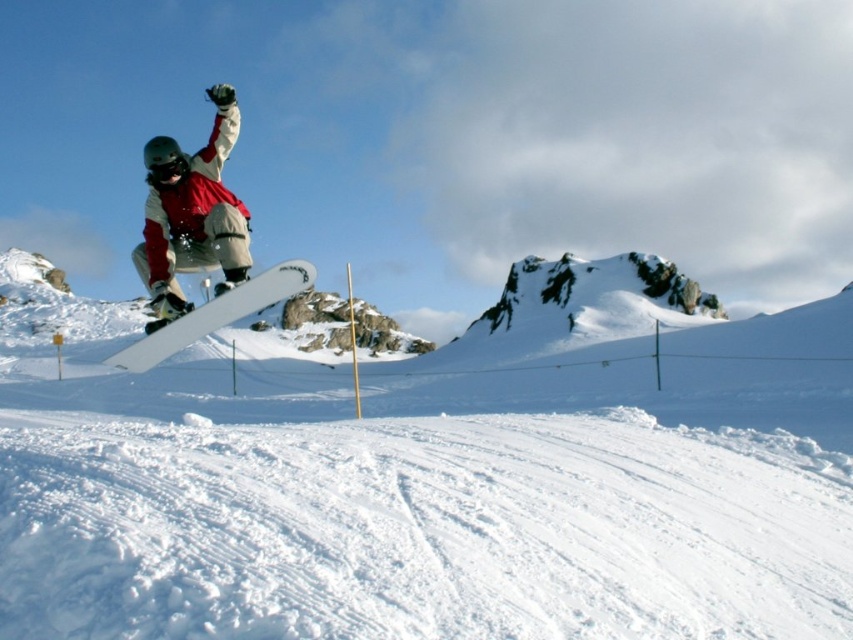
Question: Among these objects, which one is farthest from the camera?

Choices:
 (A) matte red snowboarder at center
 (B) white matte snowboard at center

Answer: (A)

Question: Does white matte snowboard at upper left appear on the right side of white matte snowboard at center?

Choices:
 (A) yes
 (B) no

Answer: (B)

Question: Is matte white snowboard at center further to camera compared to matte red snowboarder at center?

Choices:
 (A) yes
 (B) no

Answer: (B)

Question: Does matte white snowboard at center have a larger size compared to matte red snowboarder at center?

Choices:
 (A) yes
 (B) no

Answer: (A)

Question: Which object is farther from the camera taking this photo?

Choices:
 (A) matte white snowboard at center
 (B) matte red snowboarder at center
 (C) white matte snowboard at center
 (D) white matte snowboard at upper left

Answer: (B)

Question: Which of these objects is positioned closest to the matte red snowboarder at center?

Choices:
 (A) white matte snowboard at upper left
 (B) white matte snowboard at center

Answer: (B)